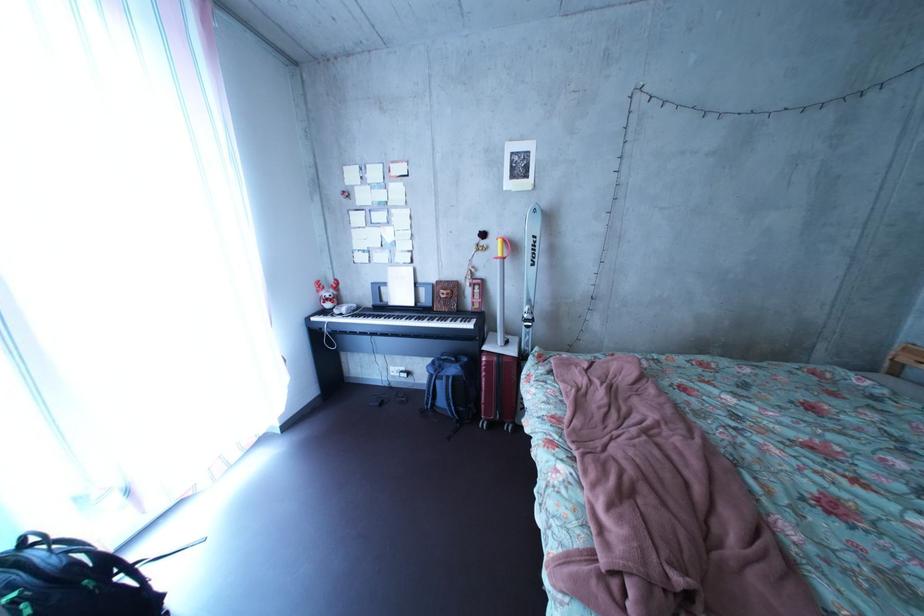
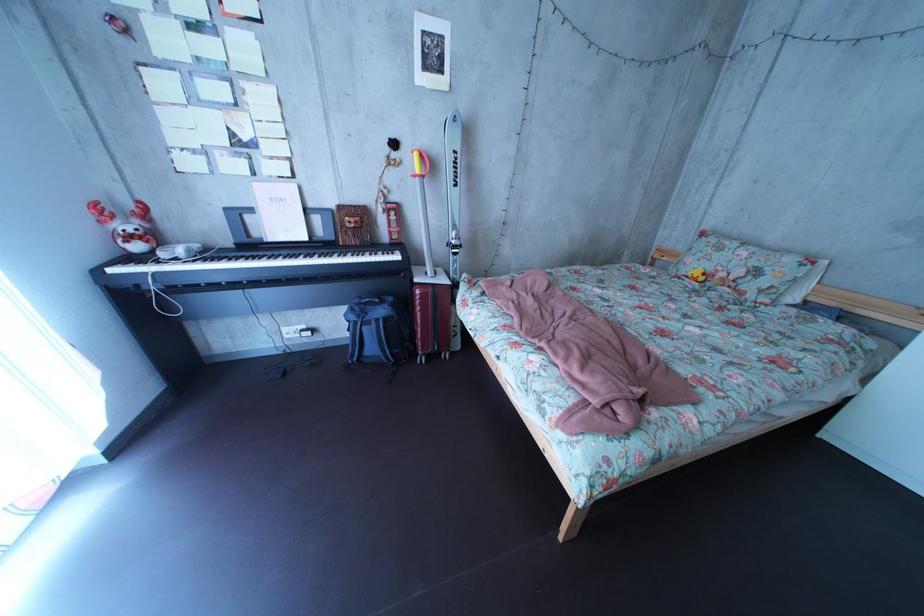
Where in the second image is the point corresponding to (x=468, y=379) from the first image?

(395, 320)